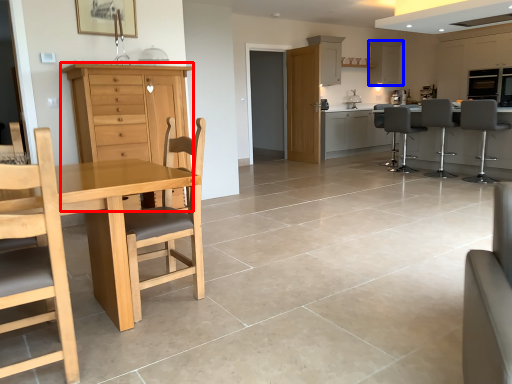
Question: Which of the following is the closest to the observer, cabinetry (highlighted by a red box) or cabinetry (highlighted by a blue box)?

Choices:
 (A) cabinetry
 (B) cabinetry

Answer: (A)